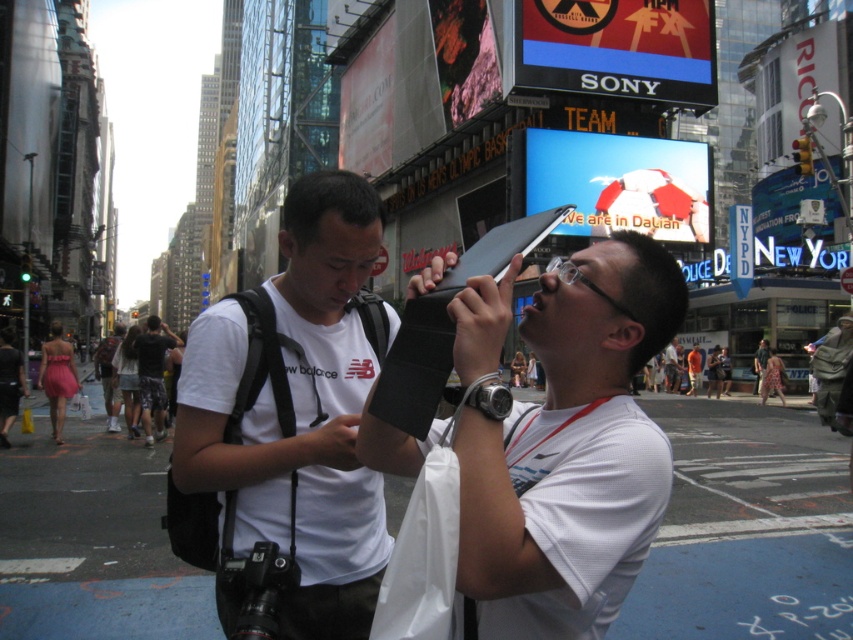
Can you confirm if black matte wallet at center is shorter than white matte t-shirt at center?

Yes, black matte wallet at center is shorter than white matte t-shirt at center.

Is black matte wallet at center behind white matte t-shirt at center?

No, black matte wallet at center is closer to the viewer.

Who is more forward, (514, 509) or (358, 248)?

Point (514, 509) is more forward.

In order to click on black matte wallet at center in this screenshot , I will do `click(572, 451)`.

Who is taller, dark gray shorts at center or white cotton t-shirt at center?

Answer: Standing taller between the two is dark gray shorts at center.

Which of these two, dark gray shorts at center or white cotton t-shirt at center, stands shorter?

Standing shorter between the two is white cotton t-shirt at center.

Describe the element at coordinates (154, 374) in the screenshot. I see `dark gray shorts at center` at that location.

At what (x,y) coordinates should I click in order to perform the action: click on dark gray shorts at center. Please return your answer as a coordinate pair (x, y). The image size is (853, 640). Looking at the image, I should click on (154, 374).

Which is more to the left, black matte wallet at center or dark gray shorts at center?

From the viewer's perspective, dark gray shorts at center appears more on the left side.

In the scene shown: Is black matte wallet at center bigger than dark gray shorts at center?

Incorrect, black matte wallet at center is not larger than dark gray shorts at center.

Between point (526, 412) and point (161, 339), which one is positioned behind?

Point (161, 339)

This screenshot has height=640, width=853. I want to click on black matte wallet at center, so click(x=572, y=451).